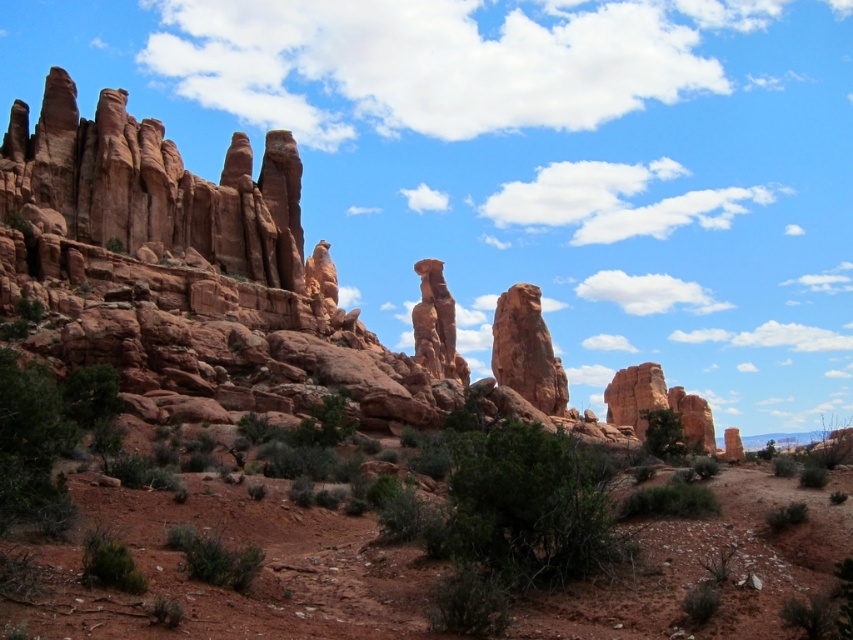
You are a hiker standing at the base of the rustic sandstone rock at center and want to reach the green shrub at lower center. Which direction should you move to get there?

The green shrub at lower center is located below the rustic sandstone rock at center, so you should move downward to reach it.

You are a hiker who wants to take a photo of the rustic sandstone rock at center and the green shrub at lower center together in the same frame. Given that your camera has a maximum zoom range of 100 meters, can you capture both objects in one shot without moving your position?

The rustic sandstone rock at center is 107.54 meters away from the green shrub at lower center. Since your camera can only zoom up to 100 meters, you cannot capture both objects in one shot without moving your position because the distance exceeds the maximum zoom range.

You are a hiker who needs to cross between the two green leafy bushes. The path between them is 20.65 meters. If your average walking speed is 1.5 meters per second, how long will it take you to walk from the green leafy bush at lower center to the green leafy bush at lower right?

The distance between the green leafy bush at lower center and the green leafy bush at lower right is 20.65 meters. At a speed of 1.5 meters per second, it will take approximately 13.77 seconds to walk between them.